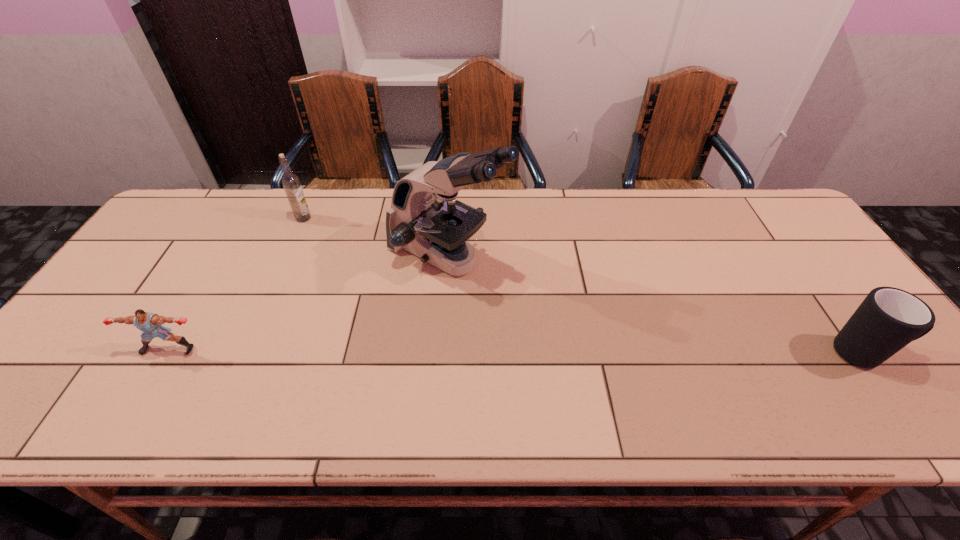
This screenshot has width=960, height=540. Identify the location of vacant position in the image that satisfies the following two spatial constraints: 1. on the front-facing side of the leftmost object; 2. on the side of the second shortest object with the handle. (166, 353).

Image resolution: width=960 pixels, height=540 pixels. In order to click on vacant region that satisfies the following two spatial constraints: 1. on the front side of the second farthest object; 2. on the right side of the second tallest object in this screenshot , I will do `click(286, 258)`.

At what (x,y) coordinates should I click in order to perform the action: click on vacant space that satisfies the following two spatial constraints: 1. on the front side of the second shortest object; 2. on the side of the microscope with the handle. Please return your answer as a coordinate pair (x, y). Image resolution: width=960 pixels, height=540 pixels. Looking at the image, I should click on (441, 353).

The height and width of the screenshot is (540, 960). In order to click on free spot that satisfies the following two spatial constraints: 1. on the front side of the third shortest object; 2. on the side of the mug with the handle in this screenshot , I will do `click(244, 353)`.

At what (x,y) coordinates should I click in order to perform the action: click on vacant position in the image that satisfies the following two spatial constraints: 1. on the front side of the vodka; 2. on the right side of the microscope. Please return your answer as a coordinate pair (x, y). Image resolution: width=960 pixels, height=540 pixels. Looking at the image, I should click on (286, 258).

Locate an element on the screen. blank area in the image that satisfies the following two spatial constraints: 1. on the front side of the third object from left to right; 2. on the left side of the vodka is located at coordinates coord(286,258).

This screenshot has height=540, width=960. In order to click on vacant space that satisfies the following two spatial constraints: 1. on the front side of the vodka; 2. on the right side of the second object from right to left in this screenshot , I will do pyautogui.click(x=286, y=258).

Where is `free spot that satisfies the following two spatial constraints: 1. on the front side of the second object from left to right; 2. on the side of the rightmost object with the handle`? The image size is (960, 540). free spot that satisfies the following two spatial constraints: 1. on the front side of the second object from left to right; 2. on the side of the rightmost object with the handle is located at coordinates (244, 353).